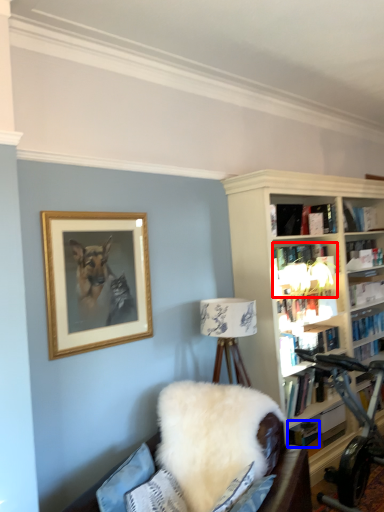
Question: Which object is closer to the camera taking this photo, book (highlighted by a red box) or book (highlighted by a blue box)?

Choices:
 (A) book
 (B) book

Answer: (A)